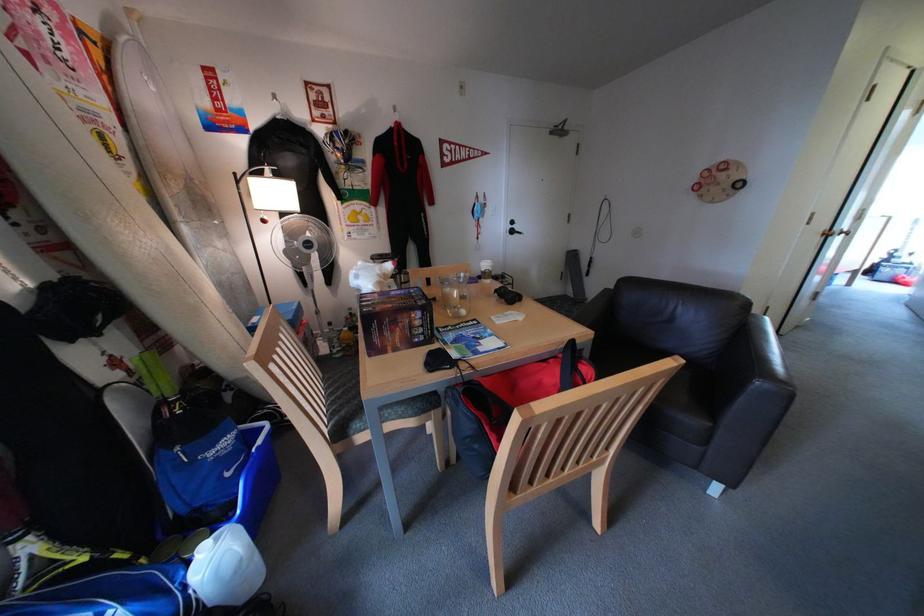
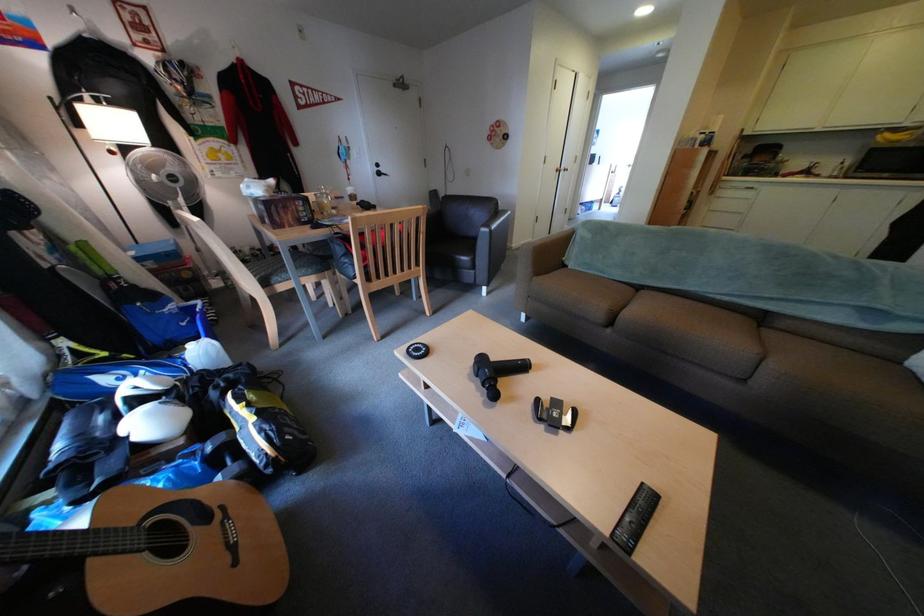
In the second image, find the point that corresponds to (x=714, y=448) in the first image.

(487, 273)